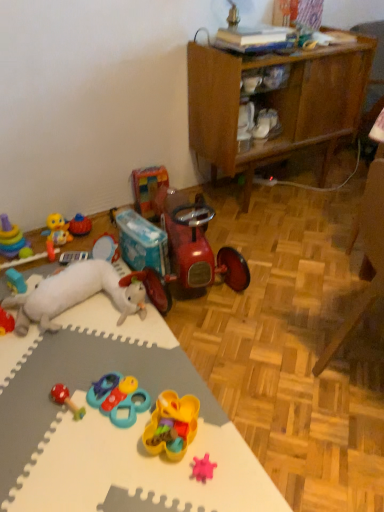
Question: Can you confirm if rubber teething ring at lower left, the 3th toy in the left-to-right sequence, is thinner than wooden cabinet at upper right?

Choices:
 (A) no
 (B) yes

Answer: (B)

Question: From the image's perspective, is rubber teething ring at lower left, the 3th toy in the left-to-right sequence, located beneath wooden cabinet at upper right?

Choices:
 (A) no
 (B) yes

Answer: (B)

Question: From a real-world perspective, is rubber teething ring at lower left, the 3th toy in the left-to-right sequence, located beneath wooden cabinet at upper right?

Choices:
 (A) no
 (B) yes

Answer: (B)

Question: Considering the relative positions of rubber teething ring at lower left, which is the 10th toy from right to left, and wooden cabinet at upper right in the image provided, is rubber teething ring at lower left, which is the 10th toy from right to left, to the right of wooden cabinet at upper right from the viewer's perspective?

Choices:
 (A) no
 (B) yes

Answer: (A)

Question: Considering the relative positions of rubber teething ring at lower left, which is the 10th toy from right to left, and wooden cabinet at upper right in the image provided, is rubber teething ring at lower left, which is the 10th toy from right to left, to the left of wooden cabinet at upper right from the viewer's perspective?

Choices:
 (A) yes
 (B) no

Answer: (A)

Question: From a real-world perspective, is rubber teething ring at lower left, which is the 10th toy from right to left, over wooden cabinet at upper right?

Choices:
 (A) yes
 (B) no

Answer: (B)

Question: Considering the relative sizes of wooden cabinet at upper right and shiny red tricycle at center, which appears as the 10th toy when viewed from the left, in the image provided, is wooden cabinet at upper right shorter than shiny red tricycle at center, which appears as the 10th toy when viewed from the left,?

Choices:
 (A) yes
 (B) no

Answer: (B)

Question: Is wooden cabinet at upper right next to shiny red tricycle at center, acting as the third toy starting from the right, and touching it?

Choices:
 (A) no
 (B) yes

Answer: (A)

Question: From the image's perspective, is wooden cabinet at upper right located beneath shiny red tricycle at center, acting as the third toy starting from the right?

Choices:
 (A) no
 (B) yes

Answer: (A)

Question: From a real-world perspective, is wooden cabinet at upper right physically above shiny red tricycle at center, acting as the third toy starting from the right?

Choices:
 (A) no
 (B) yes

Answer: (B)

Question: From a real-world perspective, is wooden cabinet at upper right below shiny red tricycle at center, acting as the third toy starting from the right?

Choices:
 (A) no
 (B) yes

Answer: (A)

Question: Is shiny red tricycle at center, which appears as the 10th toy when viewed from the left, a part of wooden cabinet at upper right?

Choices:
 (A) no
 (B) yes

Answer: (A)

Question: Does teal plastic toy at center, the eighth toy viewed from the left, have a greater width compared to rubber duck at left, positioned as the ninth toy in right-to-left order?

Choices:
 (A) yes
 (B) no

Answer: (A)